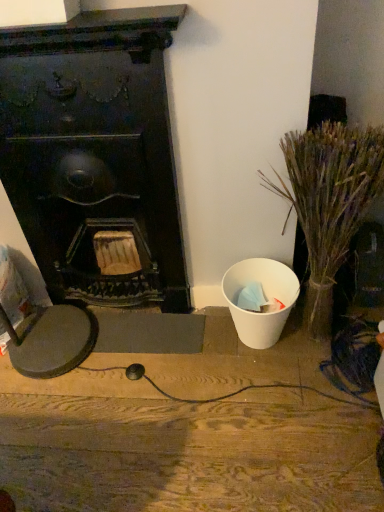
Question: Should I look upward or downward to see dry grass at right?

Choices:
 (A) down
 (B) up

Answer: (A)

Question: Does dry grass at right have a greater width compared to white matte trash can at right?

Choices:
 (A) yes
 (B) no

Answer: (B)

Question: From the image's perspective, does dry grass at right appear lower than white matte trash can at right?

Choices:
 (A) yes
 (B) no

Answer: (B)

Question: Does dry grass at right come in front of white matte trash can at right?

Choices:
 (A) no
 (B) yes

Answer: (B)

Question: Considering the relative positions of dry grass at right and white matte trash can at right in the image provided, is dry grass at right to the right of white matte trash can at right from the viewer's perspective?

Choices:
 (A) yes
 (B) no

Answer: (A)

Question: Considering the relative positions of dry grass at right and white matte trash can at right in the image provided, is dry grass at right to the left of white matte trash can at right from the viewer's perspective?

Choices:
 (A) no
 (B) yes

Answer: (A)

Question: Is dry grass at right positioned with its back to white matte trash can at right?

Choices:
 (A) yes
 (B) no

Answer: (B)

Question: Is black matte fireplace at left completely or partially inside dry grass at right?

Choices:
 (A) yes
 (B) no

Answer: (B)

Question: Considering the relative sizes of dry grass at right and black matte fireplace at left in the image provided, is dry grass at right taller than black matte fireplace at left?

Choices:
 (A) yes
 (B) no

Answer: (B)

Question: Could you tell me if dry grass at right is turned towards black matte fireplace at left?

Choices:
 (A) yes
 (B) no

Answer: (B)

Question: Can you confirm if dry grass at right is wider than black matte fireplace at left?

Choices:
 (A) no
 (B) yes

Answer: (B)

Question: Is dry grass at right positioned beyond the bounds of black matte fireplace at left?

Choices:
 (A) no
 (B) yes

Answer: (B)

Question: Considering the relative positions of dry grass at right and black matte fireplace at left in the image provided, is dry grass at right to the right of black matte fireplace at left from the viewer's perspective?

Choices:
 (A) no
 (B) yes

Answer: (B)

Question: Considering the relative positions of black matte fireplace at left and dry grass at right in the image provided, is black matte fireplace at left to the right of dry grass at right from the viewer's perspective?

Choices:
 (A) no
 (B) yes

Answer: (A)